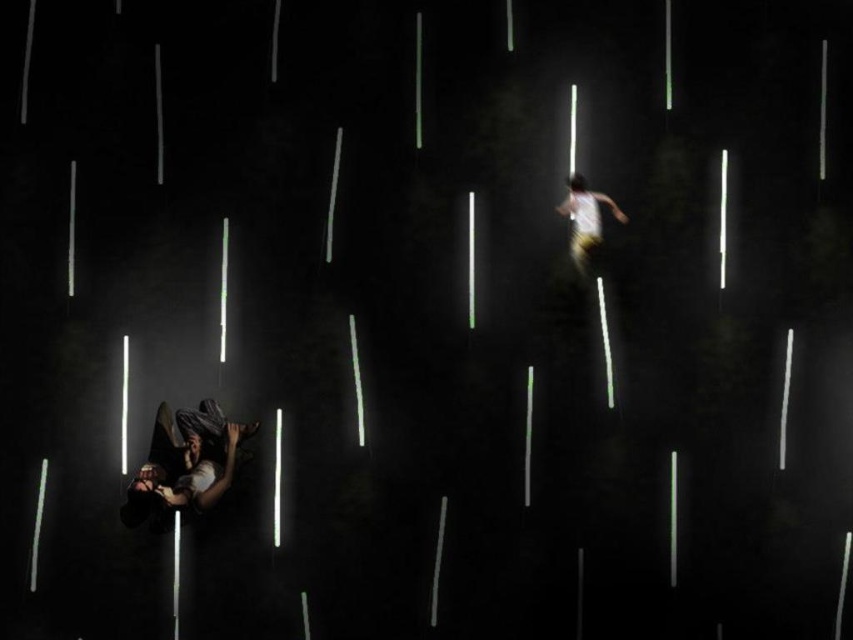
Can you confirm if dark gray fabric at lower left is positioned below white cotton shirt at upper right?

Yes, dark gray fabric at lower left is below white cotton shirt at upper right.

Who is positioned more to the right, dark gray fabric at lower left or white cotton shirt at upper right?

white cotton shirt at upper right is more to the right.

Looking at this image, who is more forward, (230, 477) or (582, 236)?

Point (230, 477)

Locate an element on the screen. The height and width of the screenshot is (640, 853). dark gray fabric at lower left is located at coordinates (184, 464).